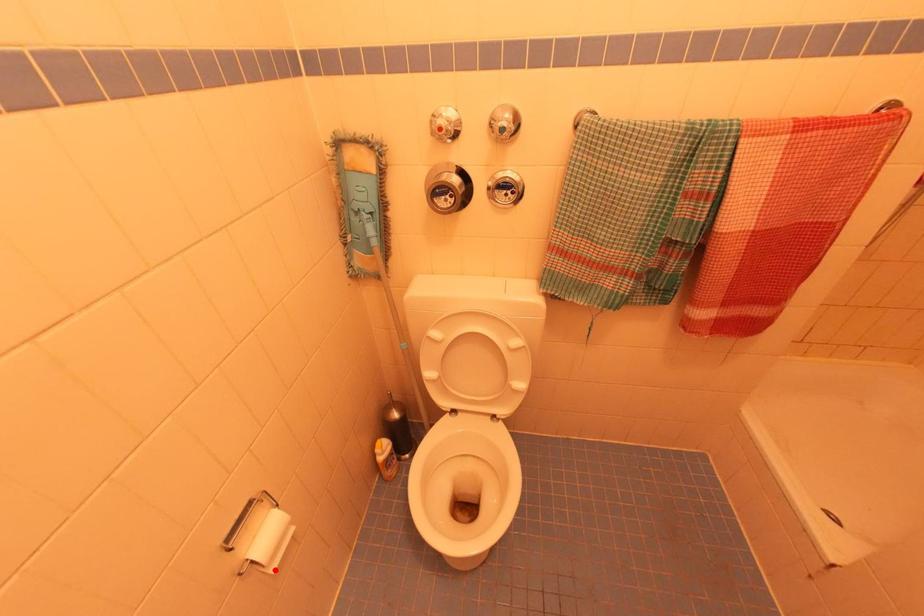
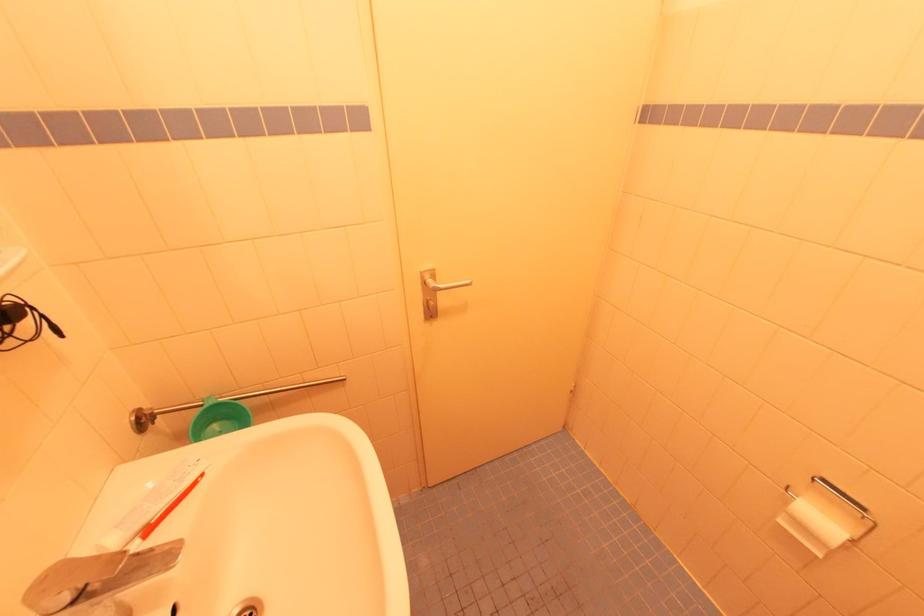
Find the pixel in the second image that matches the highlighted location in the first image.

(784, 523)